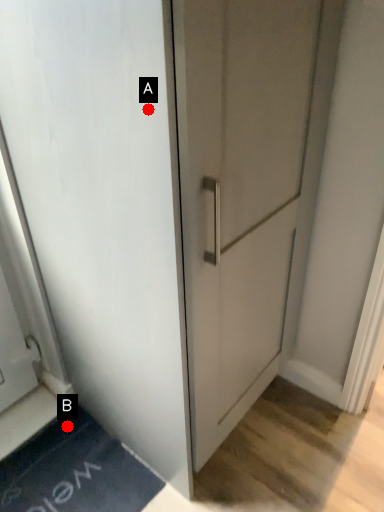
Question: Two points are circled on the image, labeled by A and B beside each circle. Which point is farther to the camera?

Choices:
 (A) A is further
 (B) B is further

Answer: (B)